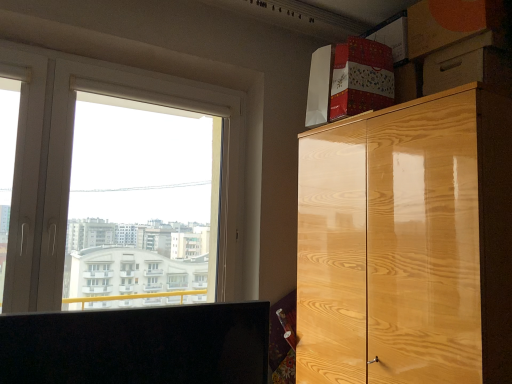
Question: From their relative heights in the image, would you say orange cardboard box at upper right is taller or shorter than glossy wood cabinet at upper right?

Choices:
 (A) short
 (B) tall

Answer: (A)

Question: Looking at their shapes, would you say orange cardboard box at upper right is wider or thinner than glossy wood cabinet at upper right?

Choices:
 (A) thin
 (B) wide

Answer: (A)

Question: Which of these objects is positioned closest to the glossy wood cabinet at upper right?

Choices:
 (A) white plastic window at upper left
 (B) orange cardboard box at upper right

Answer: (B)

Question: Based on their relative distances, which object is farther from the white plastic window at upper left?

Choices:
 (A) orange cardboard box at upper right
 (B) glossy wood cabinet at upper right

Answer: (A)